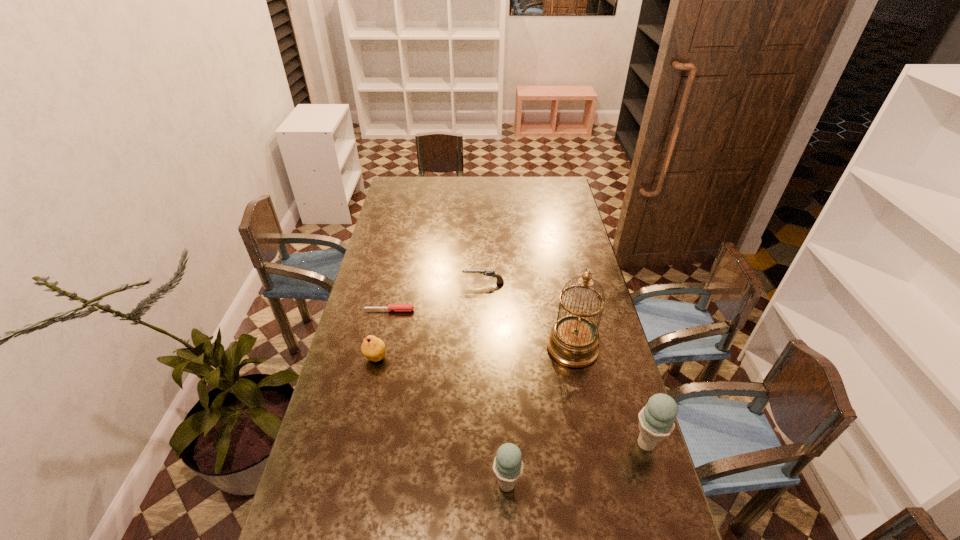
Please point a free position for a ice cream on the left. Please provide its 2D coordinates. Your answer should be formatted as a tuple, i.e. [(x, y)], where the tuple contains the x and y coordinates of a point satisfying the conditions above.

[(346, 532)]